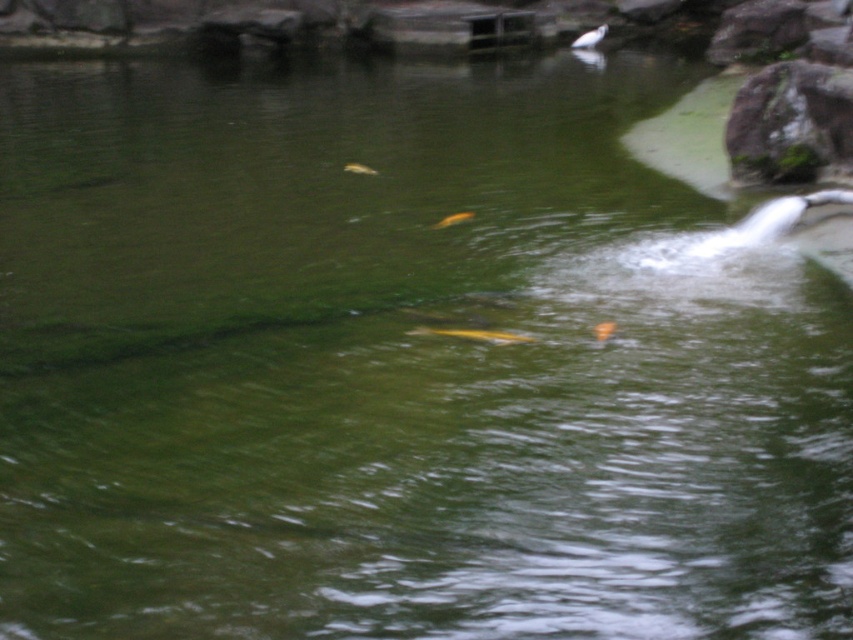
You are standing at the edge of the pond and see the orange shiny fish at center. If you want to throw a stone to hit the fish, which direction should you aim relative to the fish?

The orange shiny fish at center is located at point coordinates, so you should aim directly at its position since it is already at the center of the scene.

You are standing at the camera position and want to take a photo of the white glossy bird at upper center. The camera has a maximum zoom range of 25 meters. Can you capture the bird clearly without moving closer?

The white glossy bird at upper center and camera are 33.29 meters apart from each other. Since the maximum zoom is 25 meters, the bird is beyond the camera range. You cannot capture the bird clearly without moving closer.

You are an underwater photographer aiming to capture both the yellow shiny fish at center and the translucent yellow fish at center in a single shot. Based on their positions, which fish should you focus on first to ensure both are in the frame?

The yellow shiny fish at center is located below the translucent yellow fish at center. To capture both in a single shot, focus on the translucent yellow fish at center first since it is higher up, ensuring the lower positioned yellow shiny fish at center will also be included in the frame.